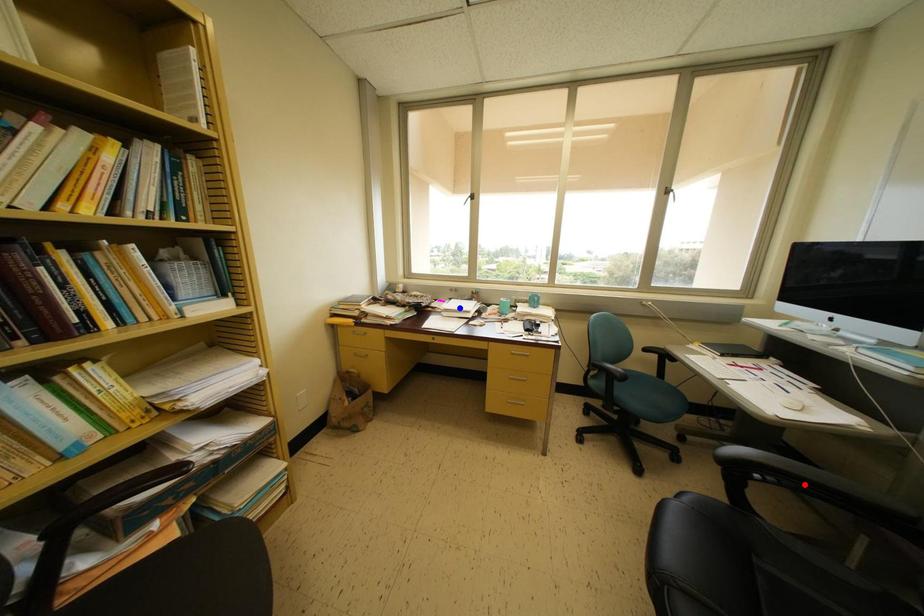
Question: Which of the two points in the image is closer to the camera?

Choices:
 (A) Blue point is closer.
 (B) Red point is closer.

Answer: (B)